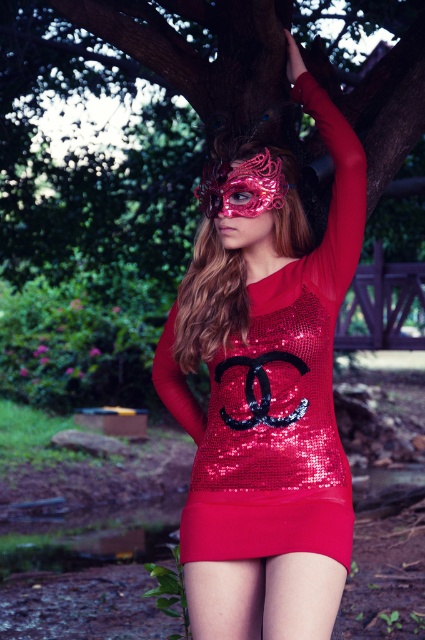
Question: Which of the following is the farthest from the observer?

Choices:
 (A) (312, 573)
 (B) (207, 536)

Answer: (B)

Question: Does shiny sequined dress at center appear over matte sequined skirt at lower center?

Choices:
 (A) no
 (B) yes

Answer: (B)

Question: Which of the following is the closest to the observer?

Choices:
 (A) matte sequined skirt at lower center
 (B) shiny sequined dress at center

Answer: (B)

Question: Observing the image, what is the correct spatial positioning of shiny sequined dress at center in reference to matte sequined skirt at lower center?

Choices:
 (A) below
 (B) above

Answer: (B)

Question: Does shiny sequined dress at center appear on the left side of matte sequined skirt at lower center?

Choices:
 (A) yes
 (B) no

Answer: (A)